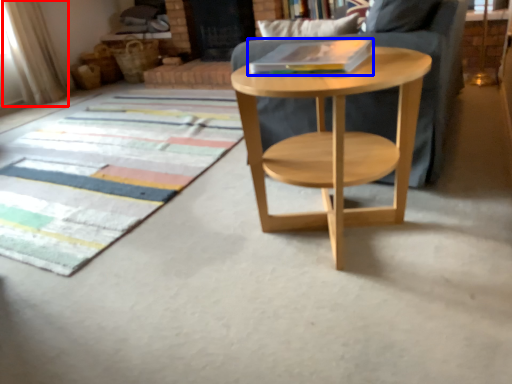
Question: Which object appears farthest to the camera in this image, curtain (highlighted by a red box) or book (highlighted by a blue box)?

Choices:
 (A) curtain
 (B) book

Answer: (A)